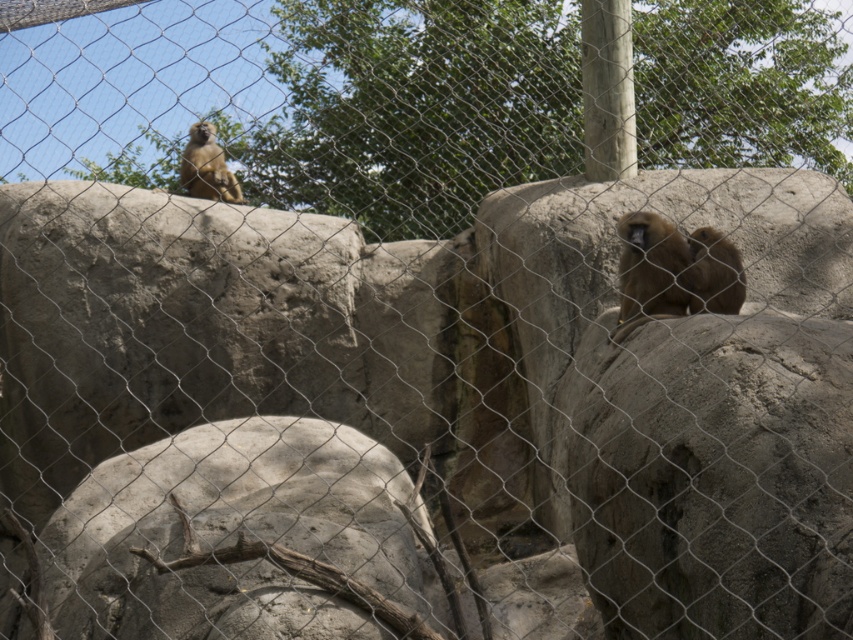
Question: Is brown furry monkey at right thinner than brown furry monkey at upper left?

Choices:
 (A) yes
 (B) no

Answer: (A)

Question: Is brown furry monkey at right thinner than brown furry monkey at upper left?

Choices:
 (A) no
 (B) yes

Answer: (B)

Question: Does brown furry monkey at right appear on the right side of brown furry monkey at upper left?

Choices:
 (A) no
 (B) yes

Answer: (B)